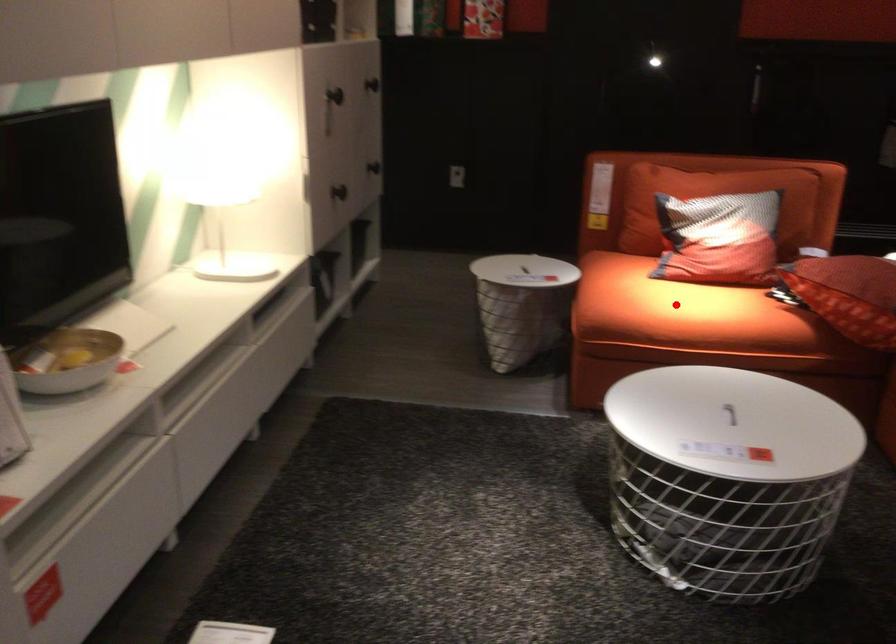
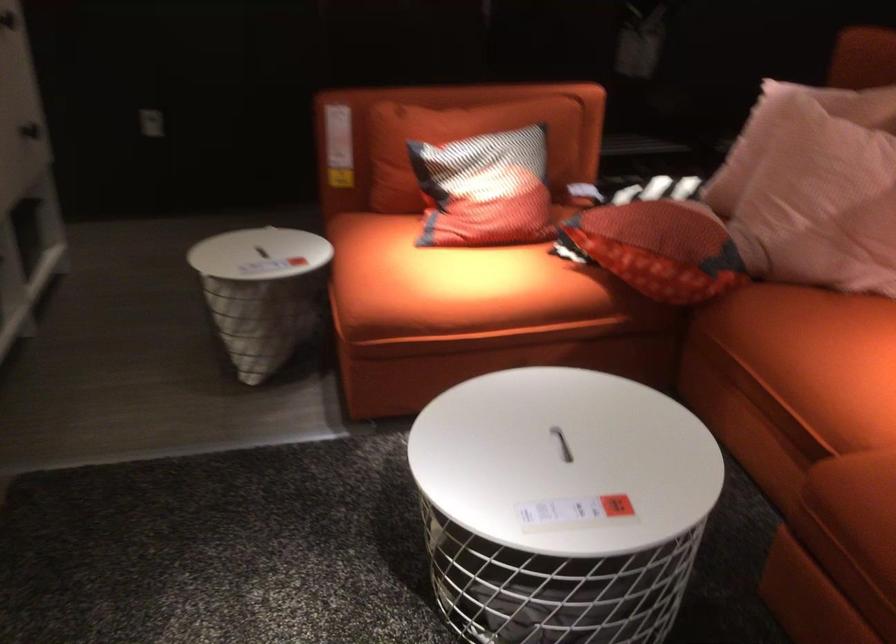
Find the pixel in the second image that matches the highlighted location in the first image.

(449, 281)